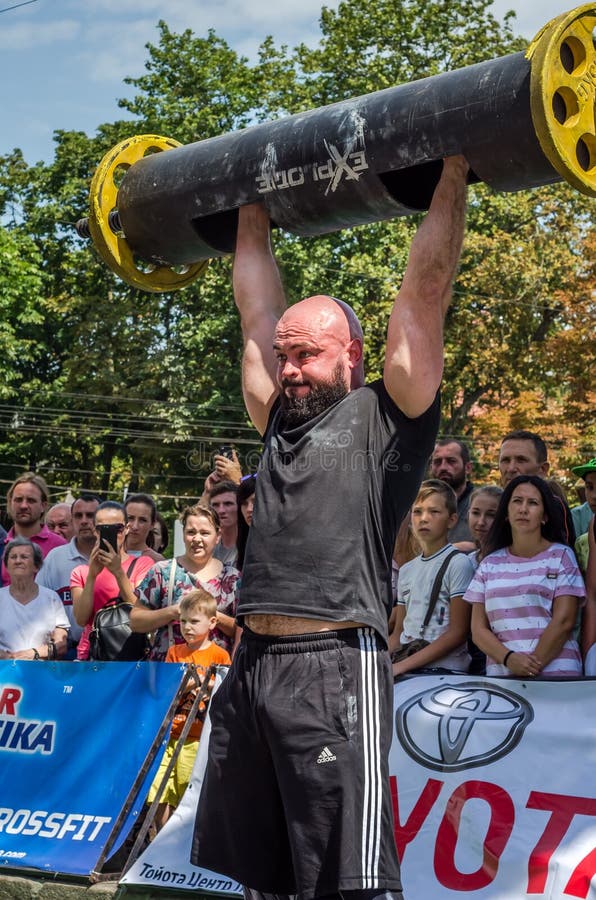
The height and width of the screenshot is (900, 596). I want to click on phone, so [x=229, y=454], [x=111, y=529].